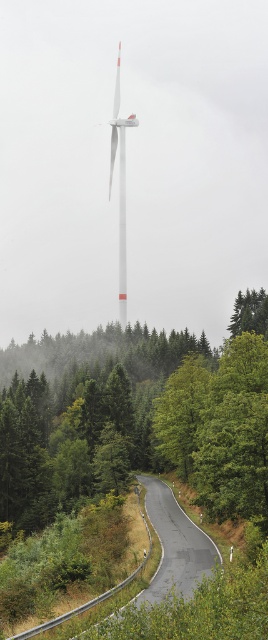
Is asphalt road at center wider than white matte wind turbine at center?

No.

Does asphalt road at center appear over white matte wind turbine at center?

No.

Find the location of `asphalt road at center`. asphalt road at center is located at coordinates (175, 545).

What are the coordinates of `asphalt road at center` in the screenshot? It's located at (175, 545).

Does asphalt road at center appear on the right side of green matte tree at center?

In fact, asphalt road at center is to the left of green matte tree at center.

Is asphalt road at center positioned at the back of green matte tree at center?

No.

Who is more forward, (187, 547) or (247, 308)?

Point (187, 547) is in front.

Locate an element on the screen. asphalt road at center is located at coordinates (175, 545).

Between green matte tree at center and white matte wind turbine at center, which one appears on the right side from the viewer's perspective?

green matte tree at center is more to the right.

Is green matte tree at center bigger than white matte wind turbine at center?

No, green matte tree at center is not bigger than white matte wind turbine at center.

Who is more distant from viewer, (259, 328) or (118, 72)?

Point (118, 72)

In order to click on green matte tree at center in this screenshot , I will do `click(250, 312)`.